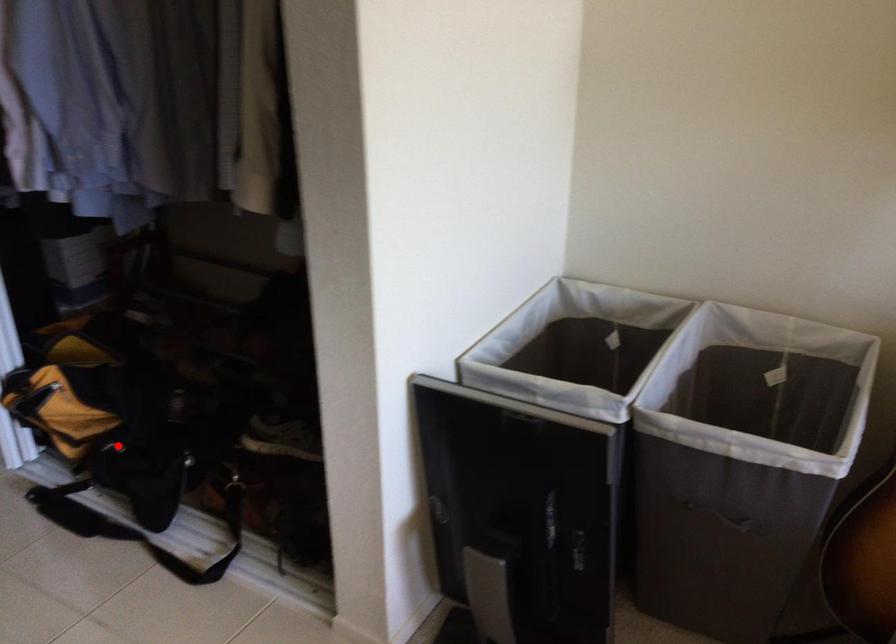
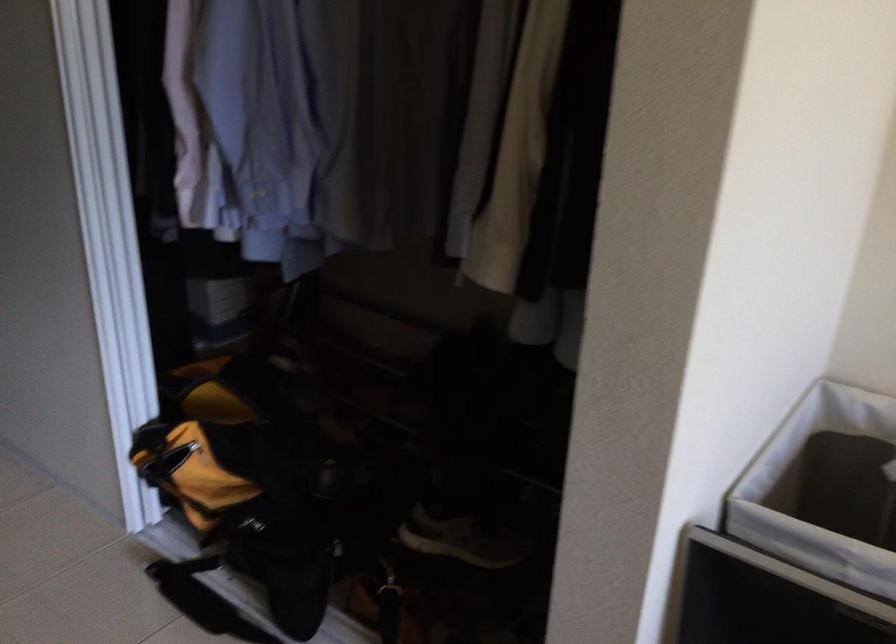
Locate, in the second image, the point that corresponds to the highlighted location in the first image.

(253, 525)